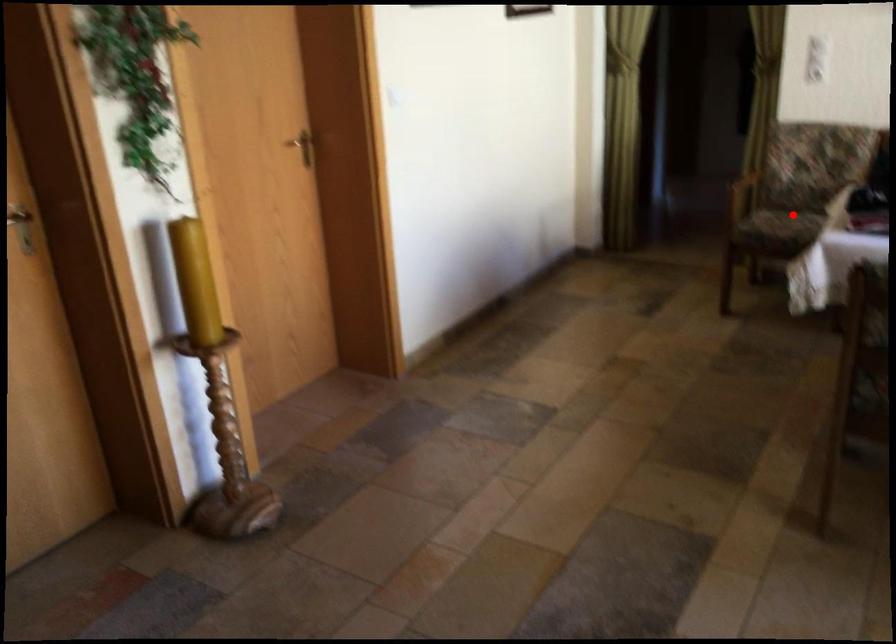
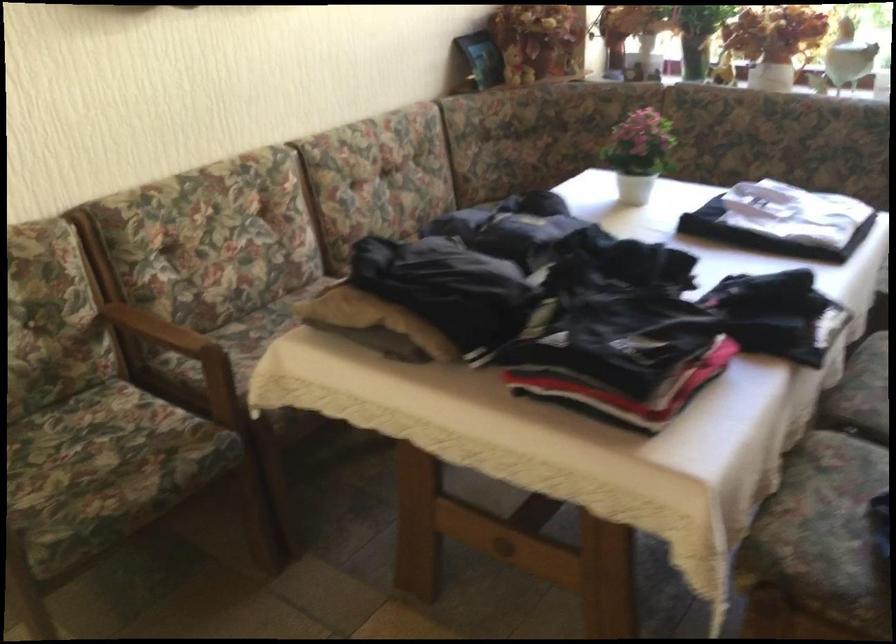
Question: I am providing you with two images of the same scene from different viewpoints. Image1 has a red point marked. In image2, the corresponding 3D location appears at what relative position? Reply with the corresponding letter.

Choices:
 (A) Closer
 (B) Farther

Answer: (A)